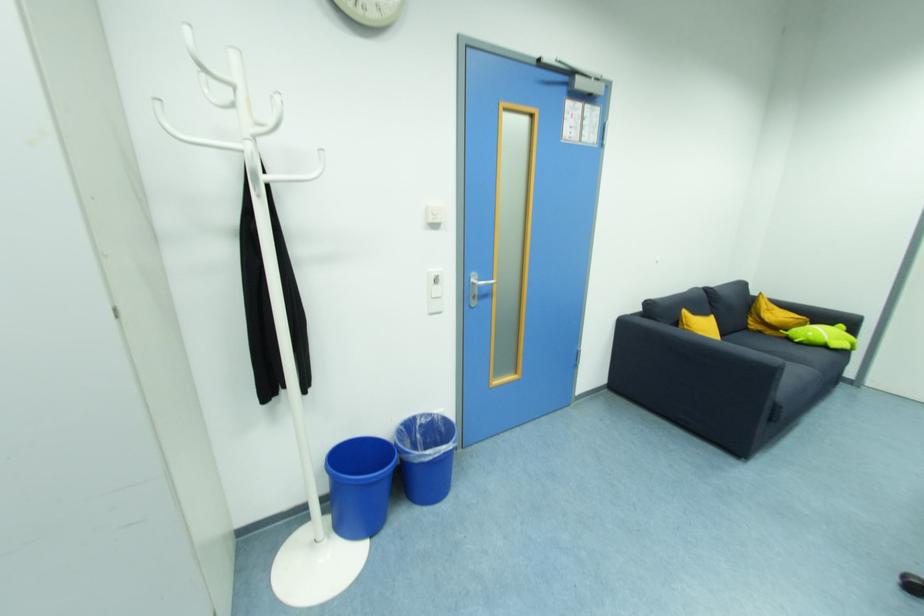
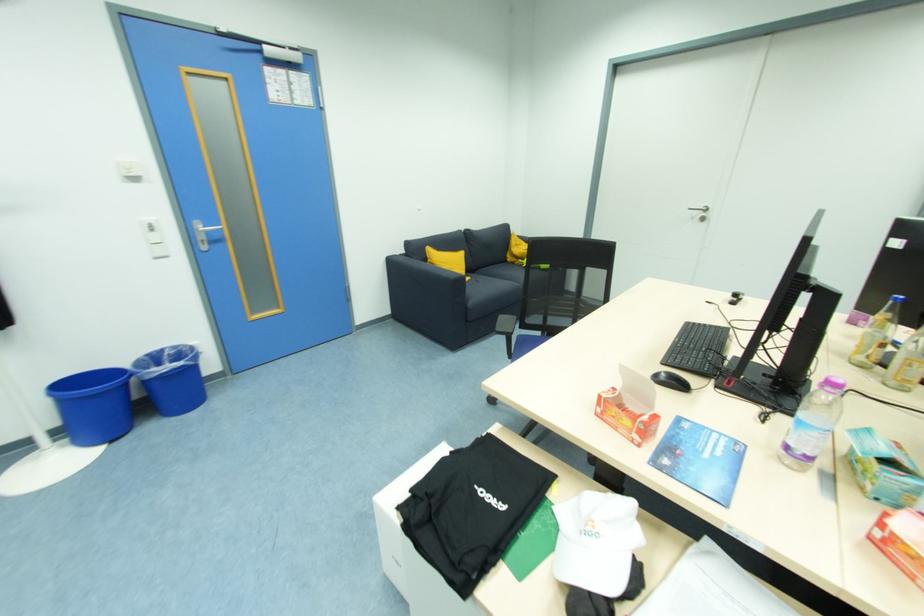
Question: I am providing you with two images of the same scene from different viewpoints. After the viewpoint changes to image2, which objects are now occluded?

Choices:
 (A) blue trash bin
 (B) plastic water bottle
 (C) glass water bottle
 (D) none of these

Answer: (D)